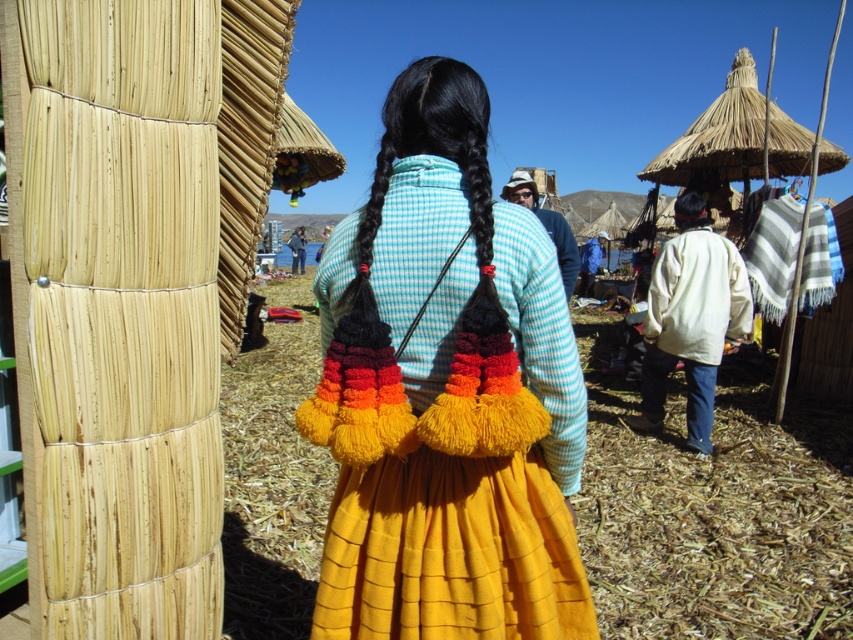
Does point (381, 184) come behind point (704, 301)?

No, (381, 184) is in front of (704, 301).

Does yarn pom-pom bag at center come behind white woolen jacket at center?

No, yarn pom-pom bag at center is in front of white woolen jacket at center.

Is point (352, 232) positioned behind point (701, 376)?

No, (352, 232) is in front of (701, 376).

At what (x,y) coordinates should I click in order to perform the action: click on yarn pom-pom bag at center. Please return your answer as a coordinate pair (x, y). This screenshot has height=640, width=853. Looking at the image, I should click on (445, 394).